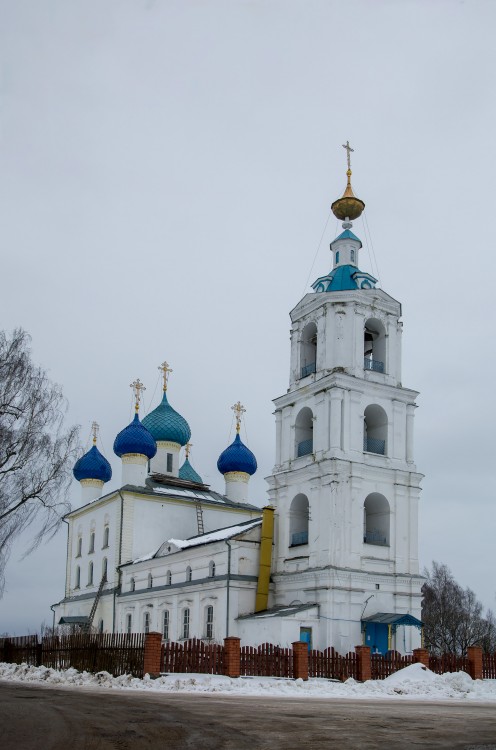
Where is `door`? The height and width of the screenshot is (750, 496). door is located at coordinates (371, 639).